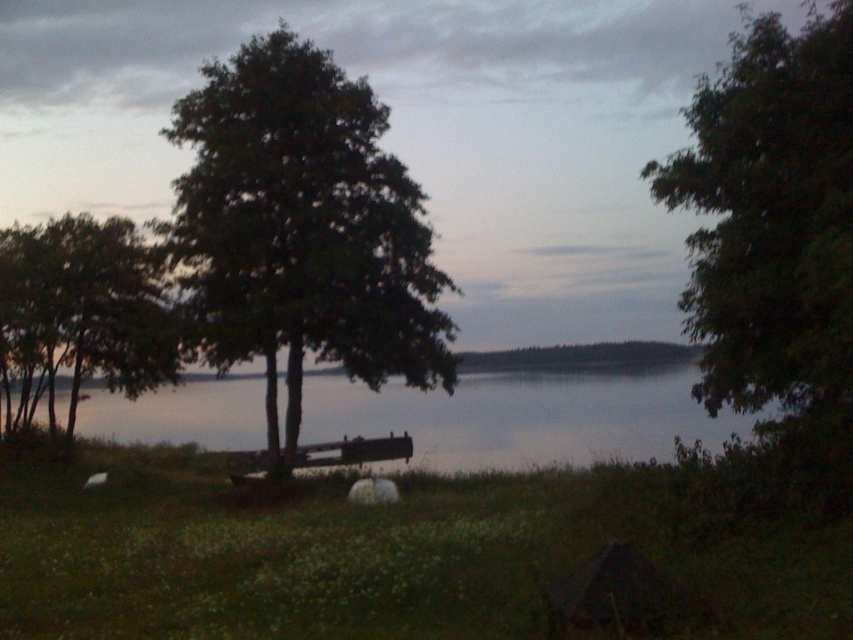
Question: Is green leafy tree at right above green leafy tree at left?

Choices:
 (A) no
 (B) yes

Answer: (B)

Question: Which point is farther to the camera?

Choices:
 (A) (345, 148)
 (B) (744, 77)
 (C) (163, 300)

Answer: (C)

Question: Which object is the closest to the green leafy tree at right?

Choices:
 (A) green leafy tree at left
 (B) green grassy at center
 (C) green leafy tree at center

Answer: (B)

Question: Which point is closer to the camera?

Choices:
 (A) green leafy tree at center
 (B) green grassy at center
 (C) green leafy tree at right

Answer: (B)

Question: Is smooth water at center wider than green leafy tree at left?

Choices:
 (A) yes
 (B) no

Answer: (A)

Question: Can you confirm if green leafy tree at center is wider than green leafy tree at left?

Choices:
 (A) no
 (B) yes

Answer: (B)